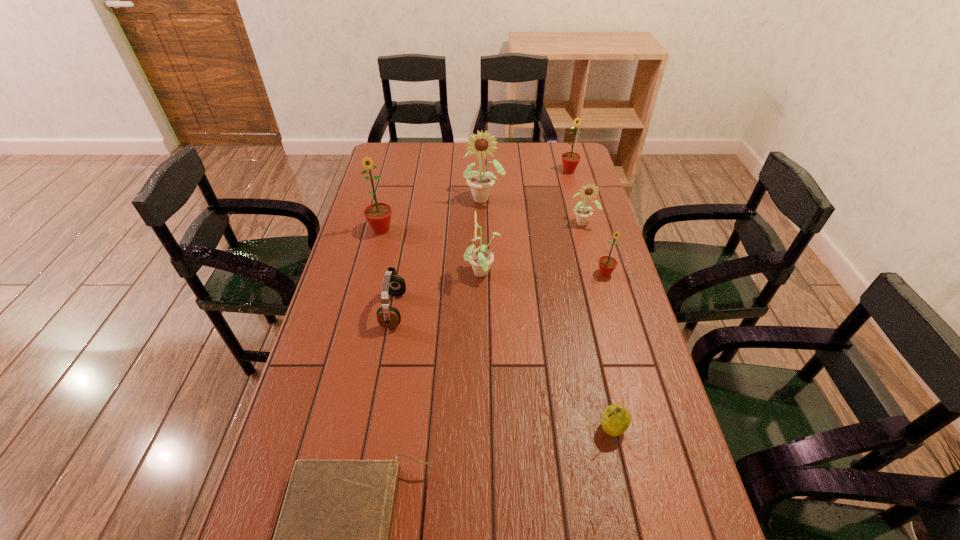
Image resolution: width=960 pixels, height=540 pixels. What are the coordinates of `headset` in the screenshot? It's located at (387, 316).

What are the coordinates of `the seventh farthest object` in the screenshot? It's located at (387, 316).

The width and height of the screenshot is (960, 540). What are the coordinates of `the eighth farthest object` in the screenshot? It's located at (615, 420).

You are a GUI agent. You are given a task and a screenshot of the screen. Output one action in this format:
    pyautogui.click(x=<x>, y=<y>)
    Task: Click on the pear
    
    Given the screenshot: What is the action you would take?
    point(615,420)

Identify the location of free space located on the front-facing side of the second farthest object. The height and width of the screenshot is (540, 960). (484, 243).

Locate an element on the screen. This screenshot has width=960, height=540. vacant space located 0.270m on the face of the leftmost green sunflower is located at coordinates (365, 294).

Find the location of a particular element. vacant region located 0.100m on the front-facing side of the second smallest yellow sunflower is located at coordinates (434, 274).

Image resolution: width=960 pixels, height=540 pixels. Identify the location of vacant space located 0.120m on the front-facing side of the second smallest yellow sunflower. (428, 274).

Locate an element on the screen. free spot located 0.350m on the front-facing side of the second smallest yellow sunflower is located at coordinates (357, 274).

This screenshot has width=960, height=540. Find the location of `vacant position located on the face of the farthest object`. vacant position located on the face of the farthest object is located at coordinates (572, 182).